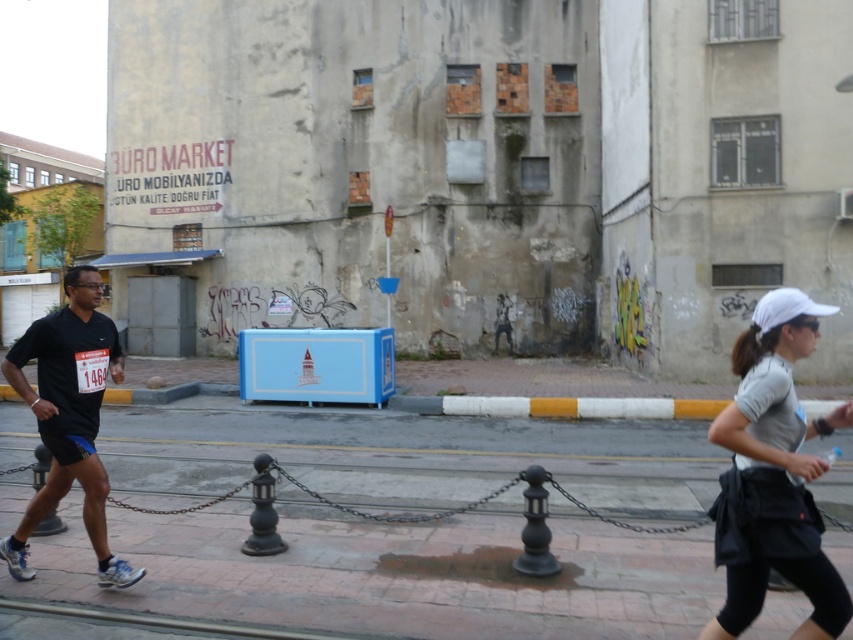
Question: Is brick pavement at lower center above black matte shirt at left?

Choices:
 (A) yes
 (B) no

Answer: (B)

Question: Among these objects, which one is nearest to the camera?

Choices:
 (A) white matte running outfit at right
 (B) brick pavement at lower center
 (C) black matte shirt at left

Answer: (A)

Question: Which of the following is the closest to the observer?

Choices:
 (A) (109, 541)
 (B) (757, 538)

Answer: (B)

Question: Which point is closer to the camera taking this photo?

Choices:
 (A) (843, 468)
 (B) (785, 561)

Answer: (B)

Question: Does brick pavement at lower center have a smaller size compared to white matte running outfit at right?

Choices:
 (A) yes
 (B) no

Answer: (B)

Question: Is white matte running outfit at right above black matte shirt at left?

Choices:
 (A) yes
 (B) no

Answer: (A)